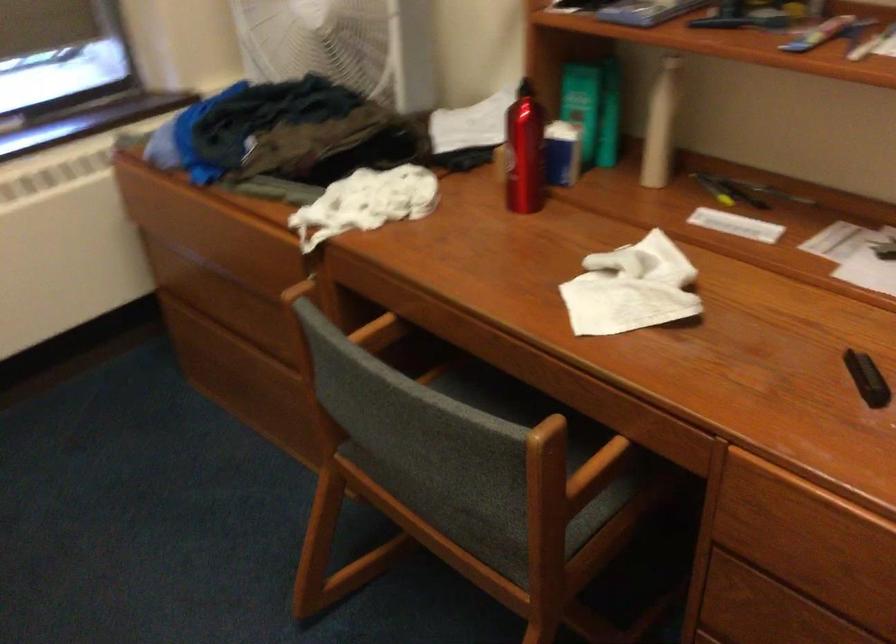
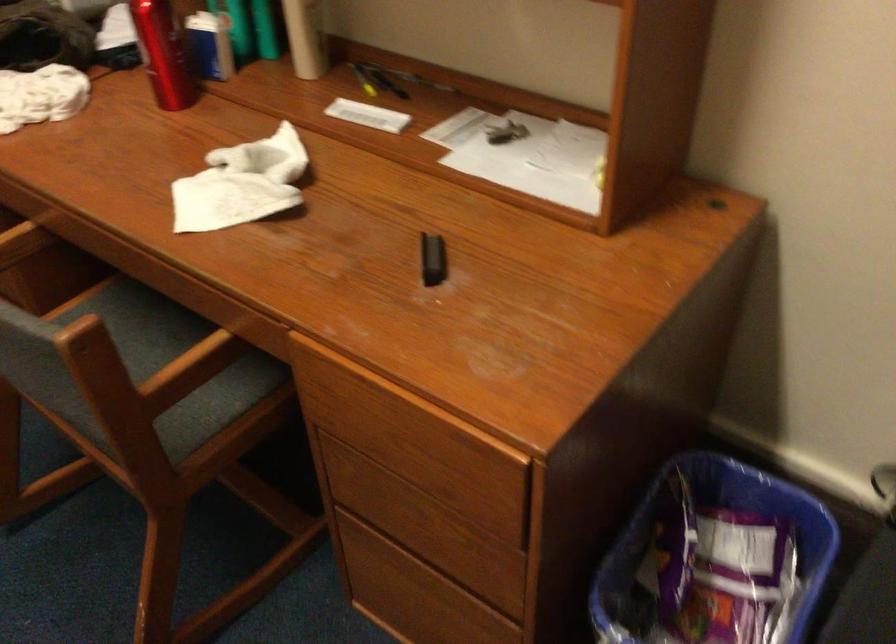
Locate, in the second image, the point that corresponds to (528,156) in the first image.

(162, 53)